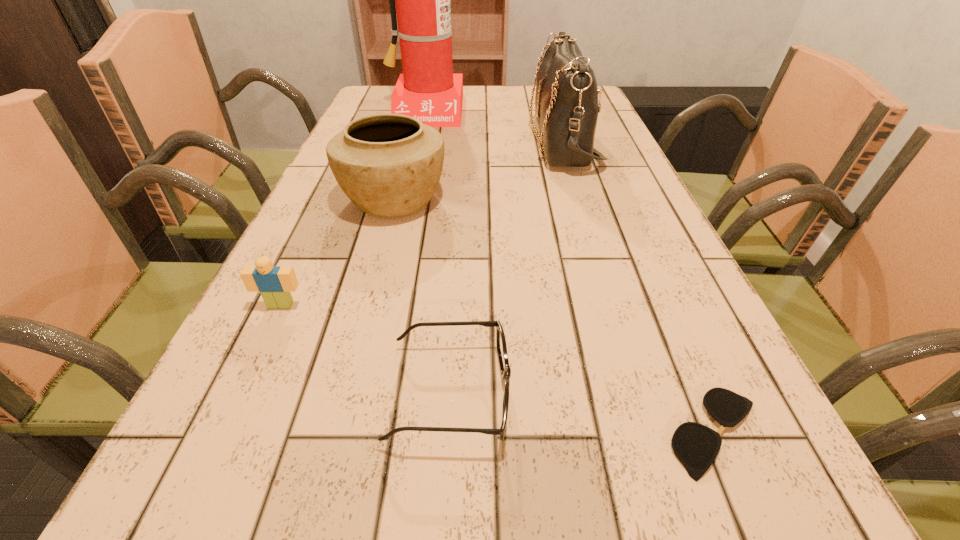
Locate an element on the screen. unoccupied position between the left spectacles and the pottery is located at coordinates (421, 296).

The height and width of the screenshot is (540, 960). What are the coordinates of `vacant point located between the third tallest object and the handbag` in the screenshot? It's located at (478, 171).

Identify the location of vacant space in between the shortest object and the tallest object. click(x=570, y=271).

This screenshot has width=960, height=540. I want to click on free space between the taller spectacles and the second tallest object, so click(506, 268).

Find the location of a particular element. The height and width of the screenshot is (540, 960). blank region between the fourth shortest object and the fourth farthest object is located at coordinates (337, 252).

Find the location of a particular element. empty space between the second shortest object and the shorter spectacles is located at coordinates (583, 413).

The height and width of the screenshot is (540, 960). What are the coordinates of `free point between the pottery and the fifth shortest object` in the screenshot? It's located at (478, 171).

At what (x,y) coordinates should I click in order to perform the action: click on vacant space that is in between the pottery and the third shortest object. Please return your answer as a coordinate pair (x, y). The width and height of the screenshot is (960, 540). Looking at the image, I should click on (337, 252).

Identify which object is the fourth closest to the tallest object. Please provide its 2D coordinates. Your answer should be formatted as a tuple, i.e. [(x, y)], where the tuple contains the x and y coordinates of a point satisfying the conditions above.

[(505, 369)]

Identify which object is the fourth nearest to the shorter spectacles. Please provide its 2D coordinates. Your answer should be formatted as a tuple, i.e. [(x, y)], where the tuple contains the x and y coordinates of a point satisfying the conditions above.

[(566, 100)]